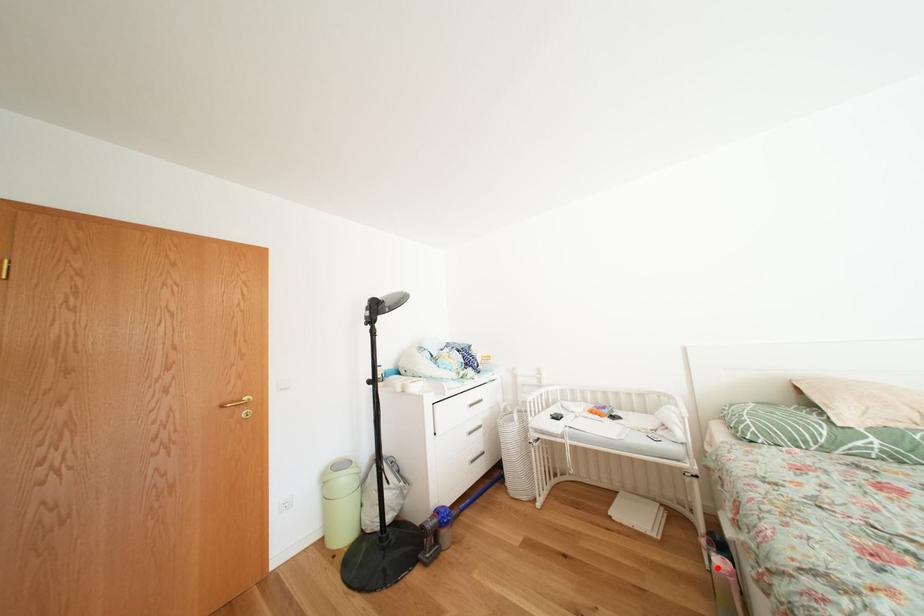
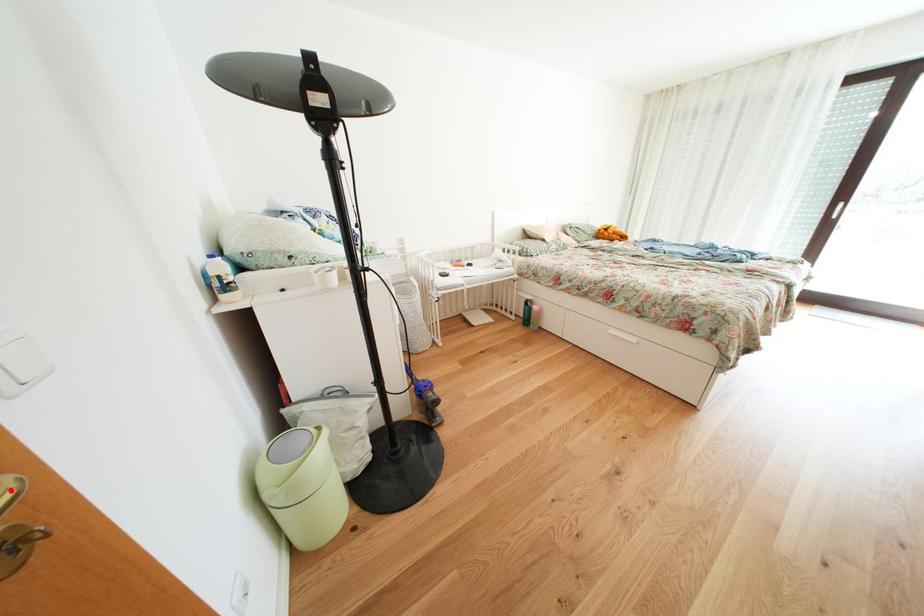
I am providing you with two images of the same scene from different viewpoints. A red point is marked on the first image and another point is marked on the second image. Is the marked point in image1 the same physical position as the marked point in image2?

No